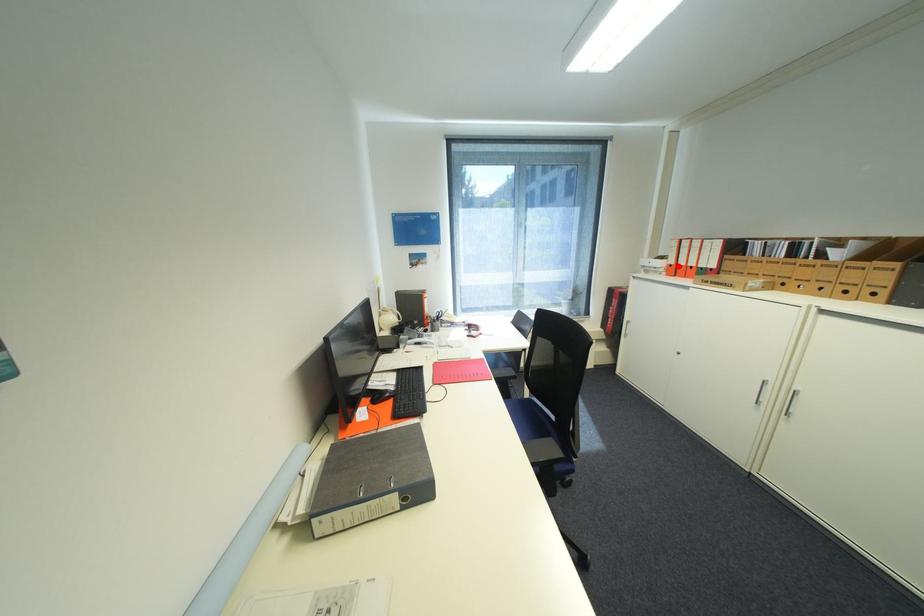
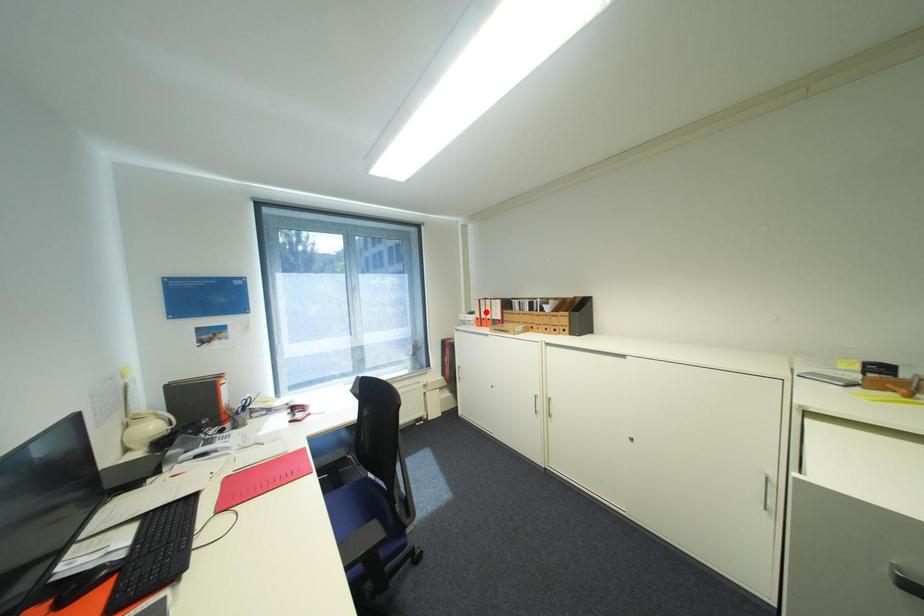
I am providing you with two images of the same scene from different viewpoints. A red point is marked on the first image and another point is marked on the second image. Is the red point in image1 aligned with the point shown in image2?

No